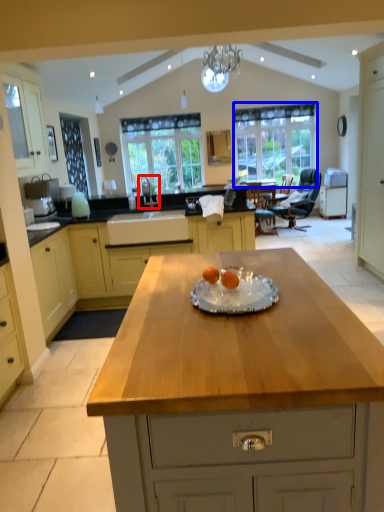
Question: Among these objects, which one is farthest to the camera, sink (highlighted by a red box) or window (highlighted by a blue box)?

Choices:
 (A) sink
 (B) window

Answer: (B)